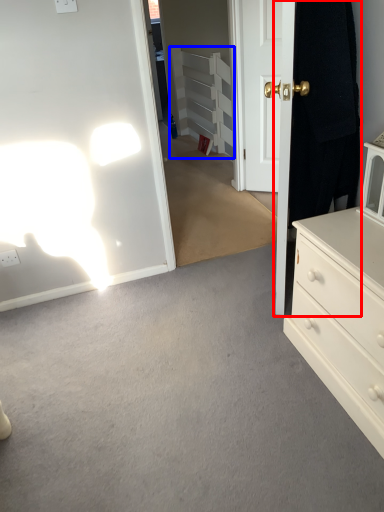
Question: Which of the following is the closest to the observer, door (highlighted by a red box) or armoire (highlighted by a blue box)?

Choices:
 (A) door
 (B) armoire

Answer: (A)